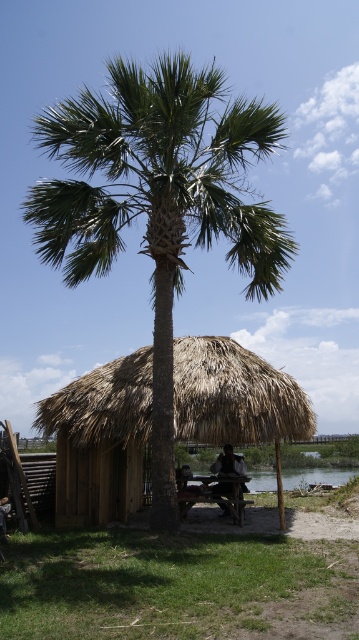
Which of these two, thatched wood hut at center or wooden picnic table at center, stands taller?

wooden picnic table at center

Does thatched wood hut at center appear on the left side of wooden picnic table at center?

Indeed, thatched wood hut at center is positioned on the left side of wooden picnic table at center.

Is point (123, 422) farther from camera compared to point (221, 504)?

No, it is not.

You are a GUI agent. You are given a task and a screenshot of the screen. Output one action in this format:
    pyautogui.click(x=<x>, y=<y>)
    Task: Click on the thatched wood hut at center
    
    Given the screenshot: What is the action you would take?
    point(100,440)

Is green leafy palm tree at center smaller than wooden picnic table at center?

No, green leafy palm tree at center is not smaller than wooden picnic table at center.

Does green leafy palm tree at center lie behind wooden picnic table at center?

No.

Which is behind, point (202, 244) or point (188, 500)?

The point (202, 244) is more distant.

At what (x,y) coordinates should I click in order to perform the action: click on green leafy palm tree at center. Please return your answer as a coordinate pair (x, y). The height and width of the screenshot is (640, 359). Looking at the image, I should click on (159, 202).

Can you confirm if green leafy palm tree at center is wider than thatched wood hut at center?

Yes.

Which is in front, point (176, 246) or point (101, 520)?

Positioned in front is point (176, 246).

Does point (245, 138) come behind point (64, 522)?

No, (245, 138) is closer to viewer.

Locate an element on the screen. green leafy palm tree at center is located at coordinates (159, 202).